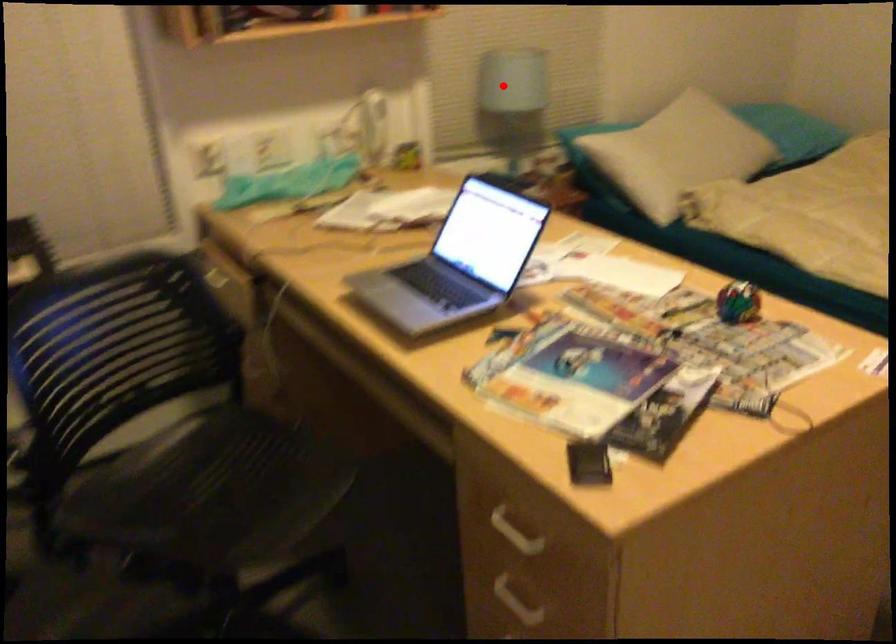
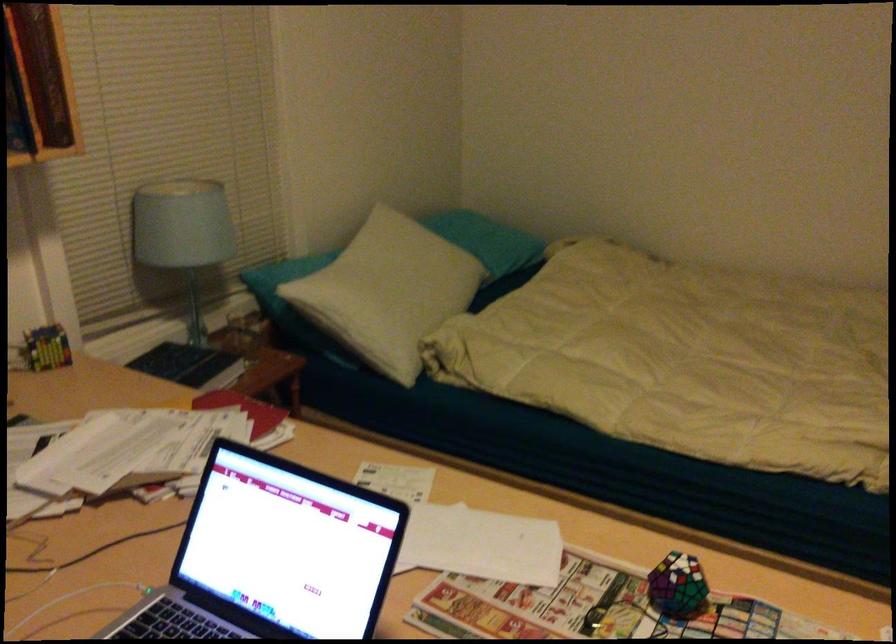
Find the pixel in the second image that matches the highlighted location in the first image.

(183, 234)